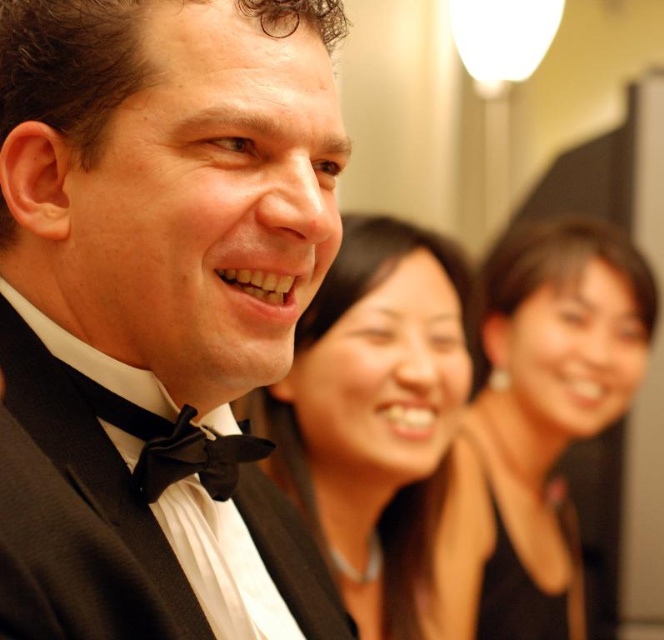
Based on the scene description, can you determine which object is taller between the black satin tuxedo at center and the black satin bow tie at lower left?

The black satin tuxedo at center is taller than the black satin bow tie at lower left according to the description.

You are standing in front of the image and want to determine the spatial relationship between two points. Which point is closer to you, point [410,561] or point [157,488]?

Point [410,561] is closer to you than point [157,488] because it is further to the viewer.

Looking at the scene, where is the smooth black hair at center in relation to the black satin bow tie at lower left?

The smooth black hair at center is to the right of the black satin bow tie at lower left.